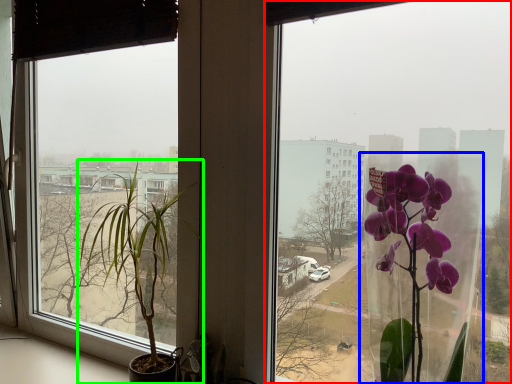
Question: Based on their relative distances, which object is nearer to window (highlighted by a red box)? Choose from glass vase (highlighted by a blue box) and houseplant (highlighted by a green box).

Choices:
 (A) glass vase
 (B) houseplant

Answer: (A)